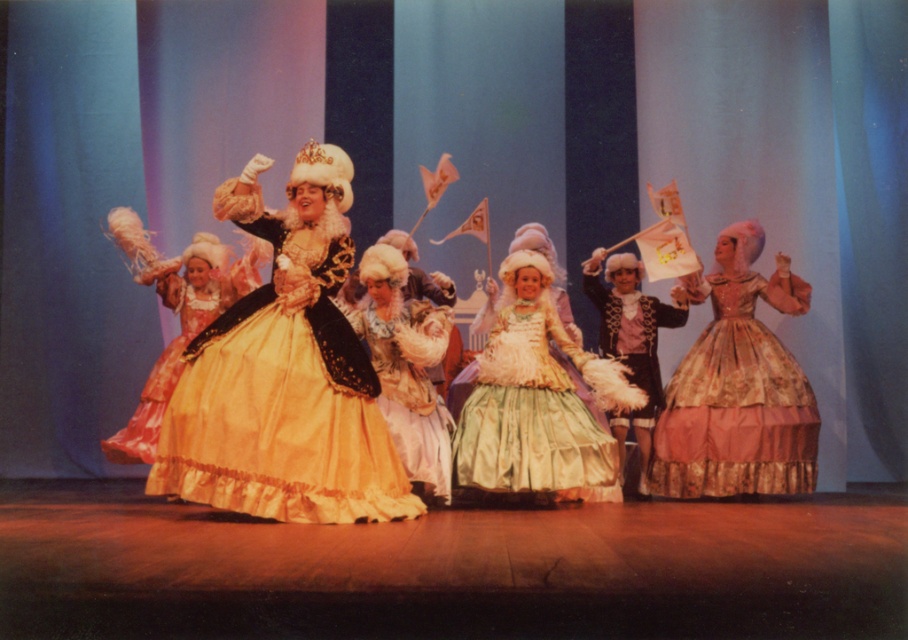
Question: Which point is farther to the camera?

Choices:
 (A) (801, 285)
 (B) (549, 456)

Answer: (A)

Question: Which of the following is the farthest from the observer?

Choices:
 (A) pastel satin dress at center
 (B) floral satin dress at right

Answer: (B)

Question: Can you confirm if silk gold gown at center is positioned below shiny gold fabric dress at center?

Choices:
 (A) no
 (B) yes

Answer: (A)

Question: Is the position of matte gold dress at center less distant than that of floral satin dress at right?

Choices:
 (A) no
 (B) yes

Answer: (B)

Question: Which point appears farthest from the camera in this image?

Choices:
 (A) (239, 360)
 (B) (229, 193)
 (C) (605, 292)
 (D) (147, 406)

Answer: (C)

Question: Can you confirm if silk satin dress at center is positioned below shiny gold fabric dress at center?

Choices:
 (A) yes
 (B) no

Answer: (A)